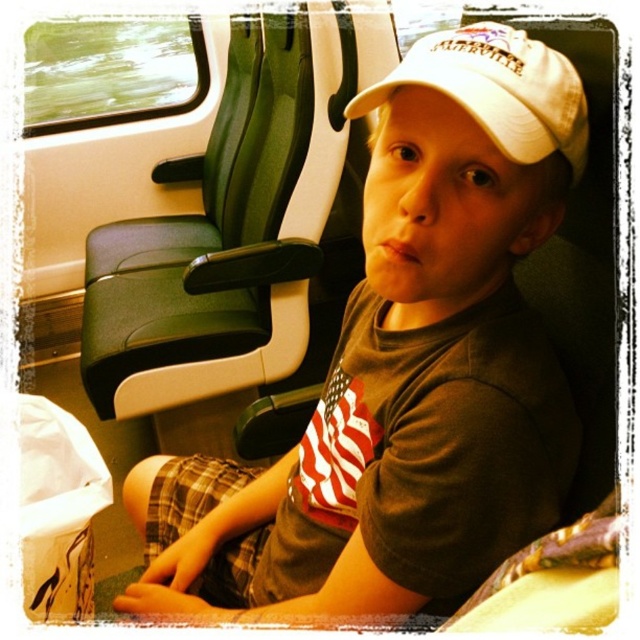
You are a passenger on a moving train and want to place both the white matte cap at upper center and the white matte baseball cap at center on a shelf that can only hold items up to the width of the wider one. Which cap should you use as the size reference?

The white matte cap at upper center is wider than the white matte baseball cap at center, so you should use the white matte cap at upper center as the size reference since it is the wider one.

You are a passenger on a train and want to know which object is taller between the white matte cap at upper center and the white matte baseball cap at center. Can you tell me?

The white matte cap at upper center is taller than the white matte baseball cap at center.

You are a passenger sitting in the train and want to know the position of the white matte cap at upper center and the white matte baseball cap at center. Which one is located higher?

The white matte baseball cap at center is located higher than the white matte cap at upper center because the white matte cap at upper center is below it.